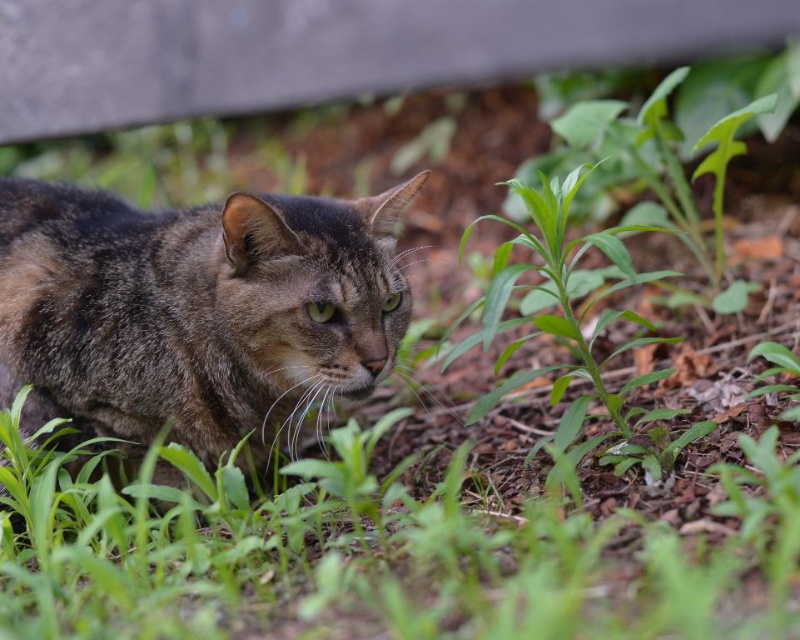
Question: Which object is farther from the camera taking this photo?

Choices:
 (A) tabby fur cat at center
 (B) green leafy plant at center

Answer: (A)

Question: Which point appears farthest from the camera in this image?

Choices:
 (A) (462, 248)
 (B) (40, 308)

Answer: (A)

Question: Is tabby fur cat at center to the right of green leafy plant at center from the viewer's perspective?

Choices:
 (A) yes
 (B) no

Answer: (B)

Question: In this image, where is tabby fur cat at center located relative to green leafy plant at center?

Choices:
 (A) right
 (B) left

Answer: (B)

Question: Is tabby fur cat at center wider than green leafy plant at center?

Choices:
 (A) yes
 (B) no

Answer: (A)